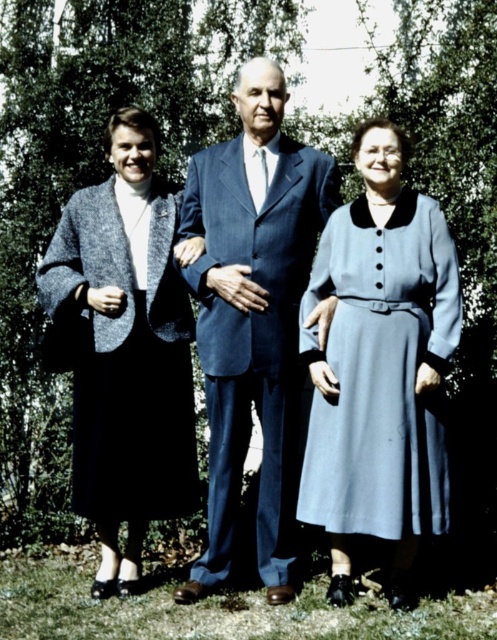
You are a photographer planning to capture a group photo of the blue fabric suit at center and the matte gray coat at left. If you want to ensure both subjects are fully visible in the frame, which subject should you position closer to the camera to avoid cropping?

You should position the blue fabric suit at center closer to the camera because its width is less than the matte gray coat at left, so it requires less space in the frame to remain visible.

Based on the scene description and the coordinates provided, which object is located at the point marked as point (252, 317)?

The point (252, 317) marks the blue fabric suit at center.

You are a photographer trying to capture a group photo of the matte blue suit at center and the blue fabric suit at center. Since you want to ensure both are clearly visible, which one should you focus on first to avoid blurriness?

The matte blue suit at center is bigger than blue fabric suit at center, so focusing on the larger matte blue suit at center first will ensure it is sharp, then adjust focus for the smaller blue fabric suit at center.